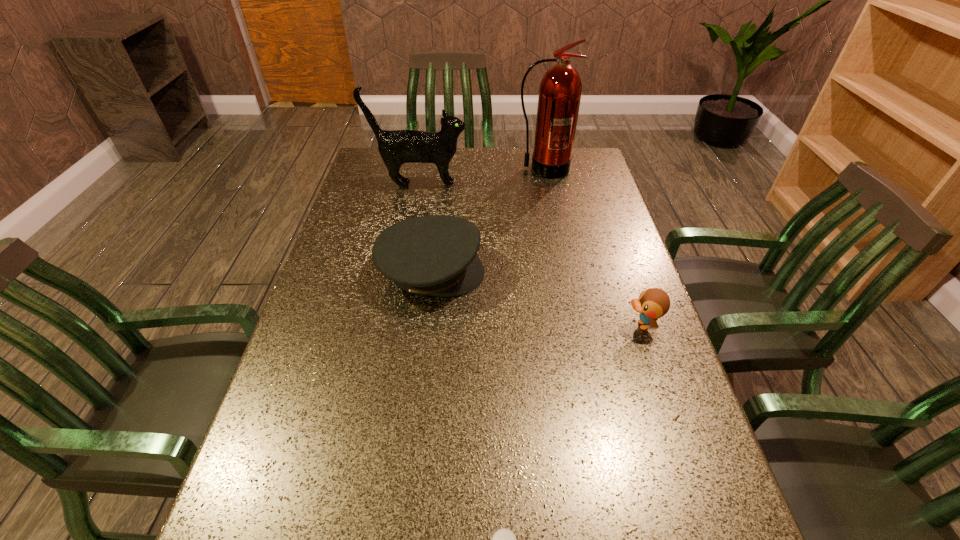
Locate an element on the screen. The width and height of the screenshot is (960, 540). fire extinguisher is located at coordinates (560, 89).

This screenshot has width=960, height=540. Find the location of `the second object from right to left`. the second object from right to left is located at coordinates (560, 89).

Find the location of a particular element. The height and width of the screenshot is (540, 960). the second tallest object is located at coordinates coord(397,147).

Locate an element on the screen. beret is located at coordinates (435, 255).

Identify the location of the second nearest object. The width and height of the screenshot is (960, 540). (653, 303).

The image size is (960, 540). I want to click on duck, so click(x=653, y=303).

Where is `free space located 0.110m on the front-facing side of the fire extinguisher`? The image size is (960, 540). free space located 0.110m on the front-facing side of the fire extinguisher is located at coordinates (549, 197).

Locate an element on the screen. blank space located on the face of the cat is located at coordinates (535, 185).

Identify the location of vacant space located on the front-facing side of the third nearest object. (578, 272).

Where is `free space located on the front-facing side of the duck`? free space located on the front-facing side of the duck is located at coordinates (561, 325).